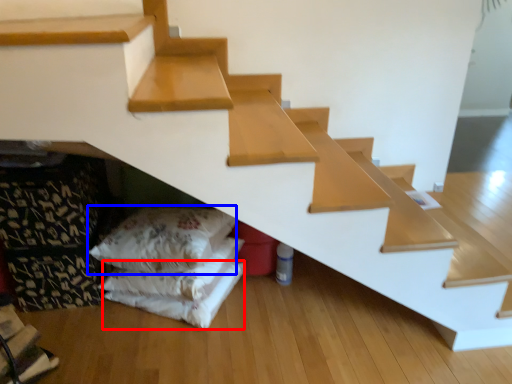
Question: Which object is closer to the camera taking this photo, sheet (highlighted by a red box) or pillow (highlighted by a blue box)?

Choices:
 (A) sheet
 (B) pillow

Answer: (B)